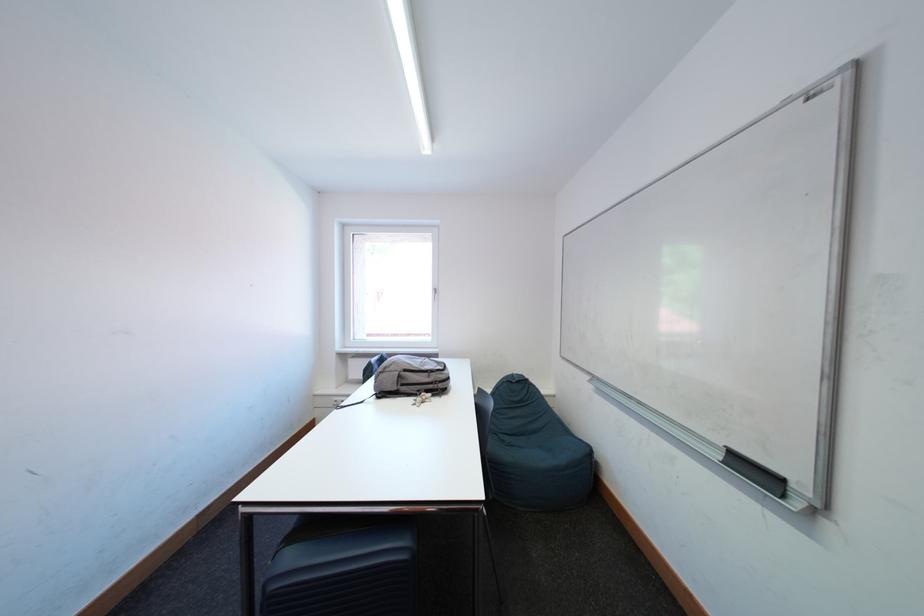
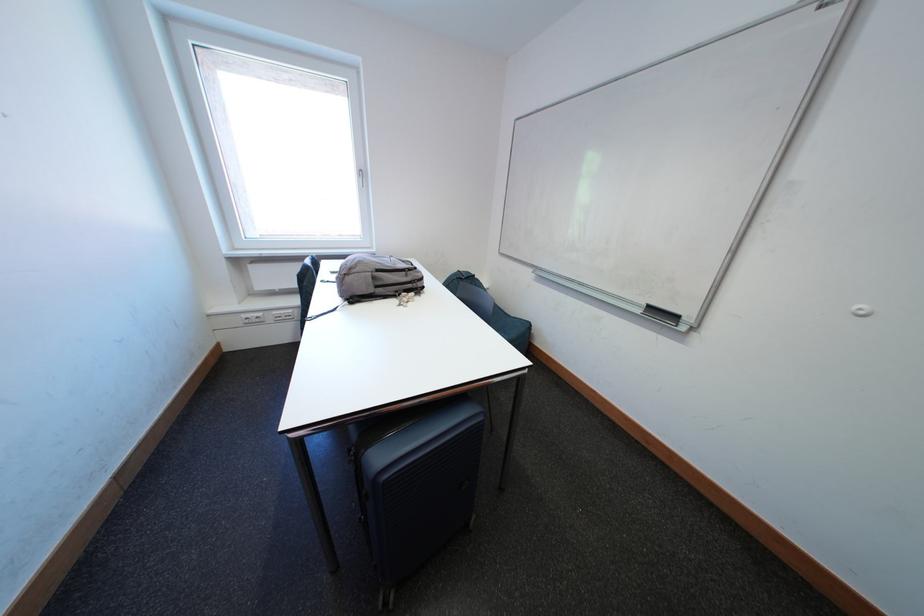
Find the pixel in the second image that matches point 345,402 in the first image.

(253, 320)